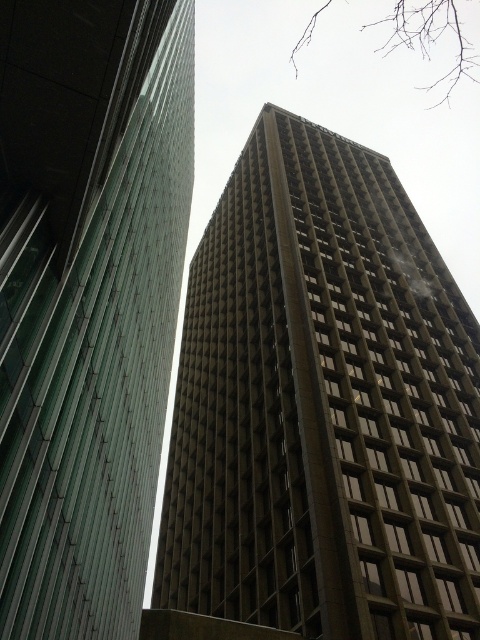
Question: Among these points, which one is farthest from the camera?

Choices:
 (A) (60, 208)
 (B) (193, 269)

Answer: (B)

Question: Does brown concrete building at center come behind green glass building at left?

Choices:
 (A) yes
 (B) no

Answer: (A)

Question: Which point is closer to the camera?

Choices:
 (A) green glass building at left
 (B) brown concrete building at center

Answer: (A)

Question: Can you confirm if brown concrete building at center is positioned below green glass building at left?

Choices:
 (A) no
 (B) yes

Answer: (B)

Question: Can you confirm if brown concrete building at center is smaller than green glass building at left?

Choices:
 (A) yes
 (B) no

Answer: (B)